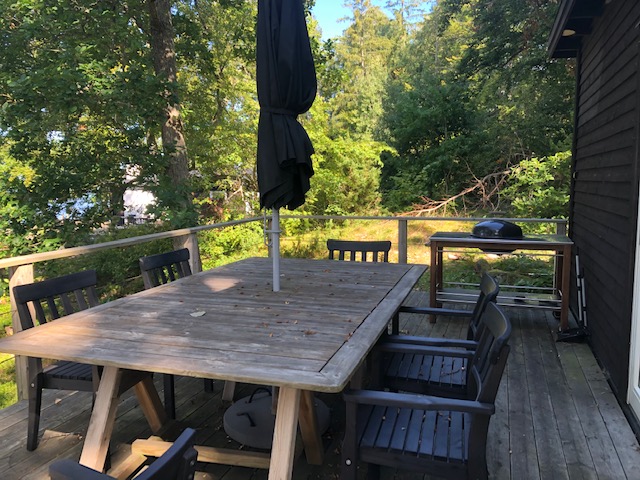
At what (x,y) coordinates should I click in order to perform the action: click on black chairs. Please return your answer as a coordinate pair (x, y). Image resolution: width=640 pixels, height=480 pixels. Looking at the image, I should click on (431, 409), (445, 348), (150, 269), (88, 294), (177, 456), (356, 244).